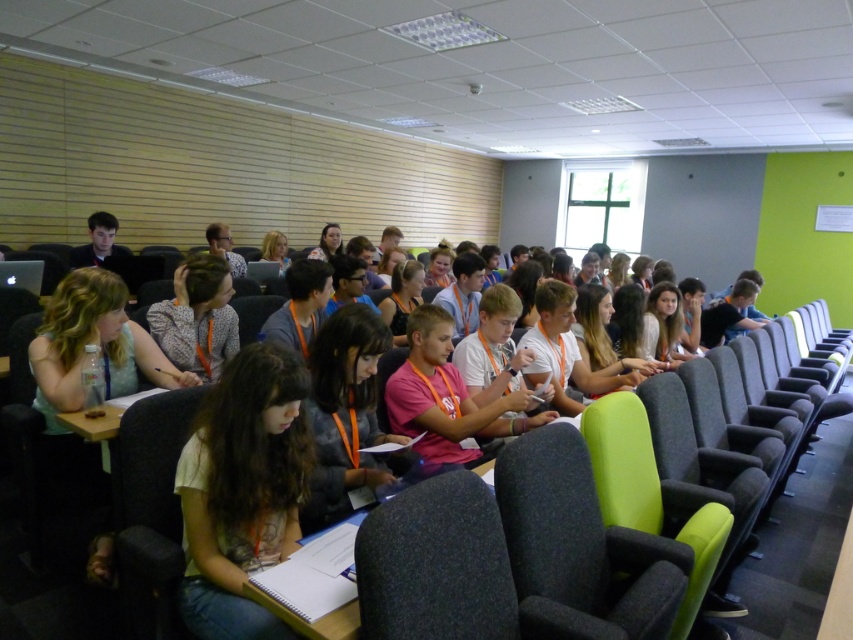
You are sitting in the front row of the classroom and notice a white cotton shirt at center and a dark gray fabric chair at center. Which object is closer to you?

The white cotton shirt at center is closer to you because the dark gray fabric chair at center is behind it.

You are standing in the classroom and notice a white cotton shirt at center and a dark gray fabric chair at center. From your perspective, which object is positioned to the left?

The white cotton shirt at center is to the left of the dark gray fabric chair at center.

You are a photographer trying to capture a candid shot of the white cotton shirt at center and the dark gray fabric chair at center. Since you want to ensure both are clearly visible in the frame, which object should you focus on first to ensure proper focus, considering their sizes?

The white cotton shirt at center is bigger than the dark gray fabric chair at center, so you should focus on the white cotton shirt at center first to ensure it is in clear focus, as larger objects require more precise focus adjustments.